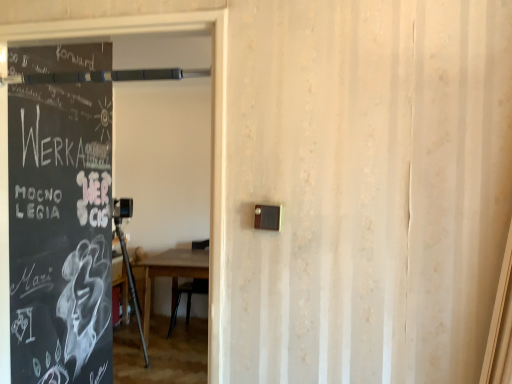
Question: Is black chalkboard at left in front of or behind wooden table at center in the image?

Choices:
 (A) front
 (B) behind

Answer: (A)

Question: Is black chalkboard at left wider or thinner than wooden table at center?

Choices:
 (A) thin
 (B) wide

Answer: (A)

Question: Considering the relative positions of black chalkboard at left and wooden table at center in the image provided, is black chalkboard at left to the left or to the right of wooden table at center?

Choices:
 (A) left
 (B) right

Answer: (B)

Question: In terms of size, does wooden table at center appear bigger or smaller than black chalkboard at left?

Choices:
 (A) small
 (B) big

Answer: (B)

Question: From a real-world perspective, relative to black chalkboard at left, is wooden table at center vertically above or below?

Choices:
 (A) below
 (B) above

Answer: (A)

Question: Is point (177, 273) positioned closer to the camera than point (223, 135)?

Choices:
 (A) farther
 (B) closer

Answer: (A)

Question: From the image's perspective, is wooden table at center located above or below black chalkboard at left?

Choices:
 (A) below
 (B) above

Answer: (A)